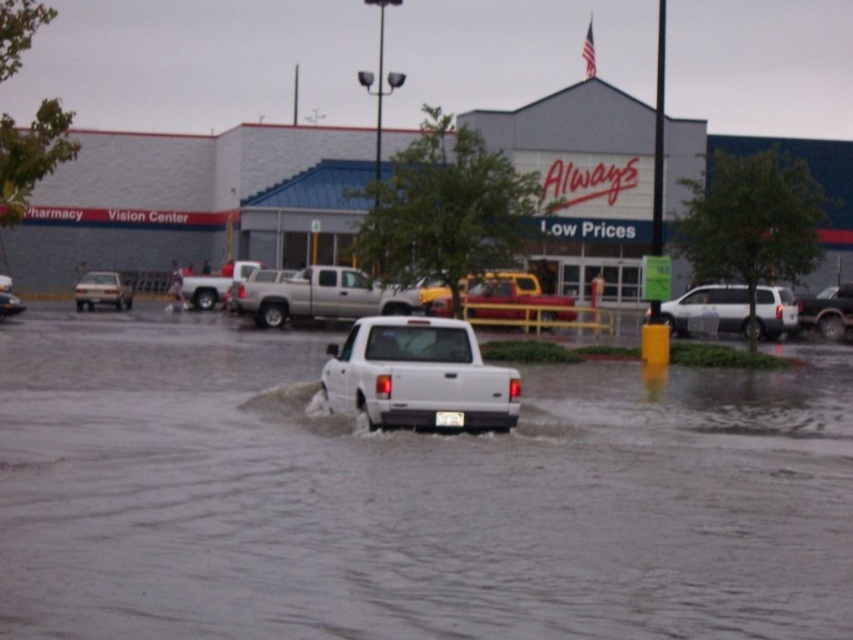
You are standing at the point marked by the coordinates [709,308] in the image. What object are you standing on?

You are standing on the white matte suv at center, which is represented by the coordinates [709,308].